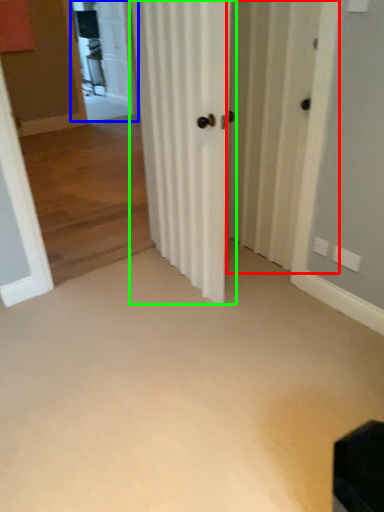
Question: Considering the real-world distances, which object is farthest from screen door (highlighted by a red box)? screen door (highlighted by a blue box) or door (highlighted by a green box)?

Choices:
 (A) screen door
 (B) door

Answer: (A)